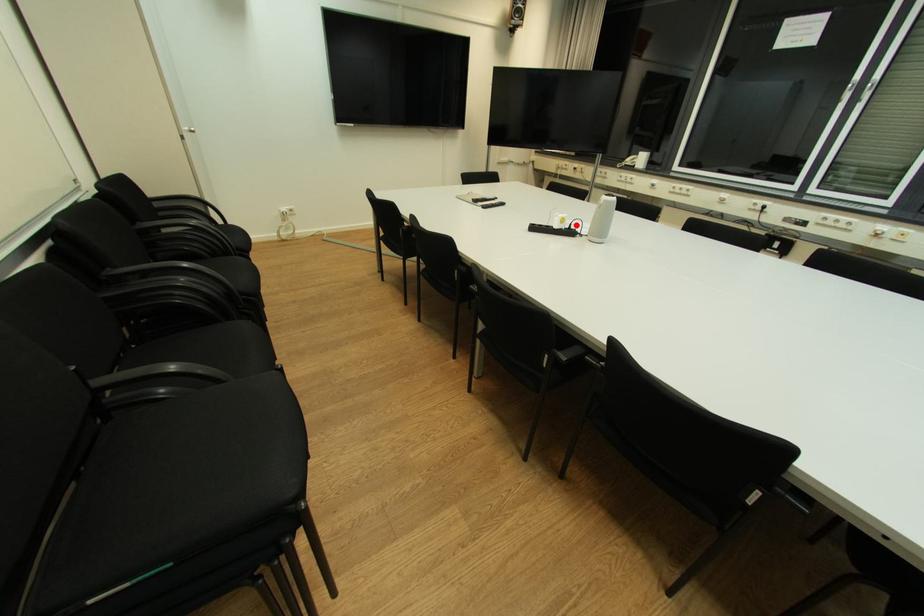
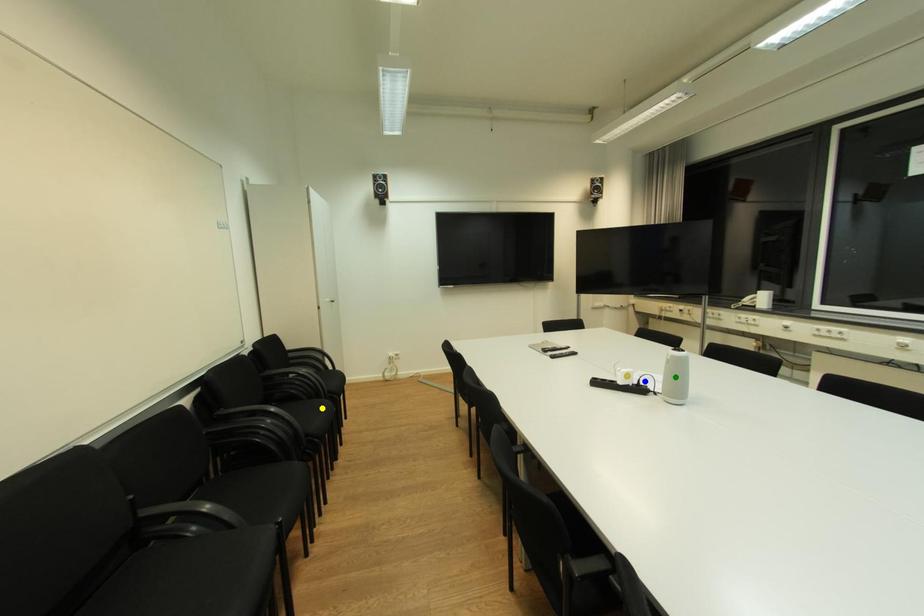
Question: I am providing you with two images of the same scene from different viewpoints. A red point is marked on the first image. You are given multiple points on the second image. Which point in image 2 is actually the same real-world point as the red point in image 1?

Choices:
 (A) yellow point
 (B) blue point
 (C) green point

Answer: (B)